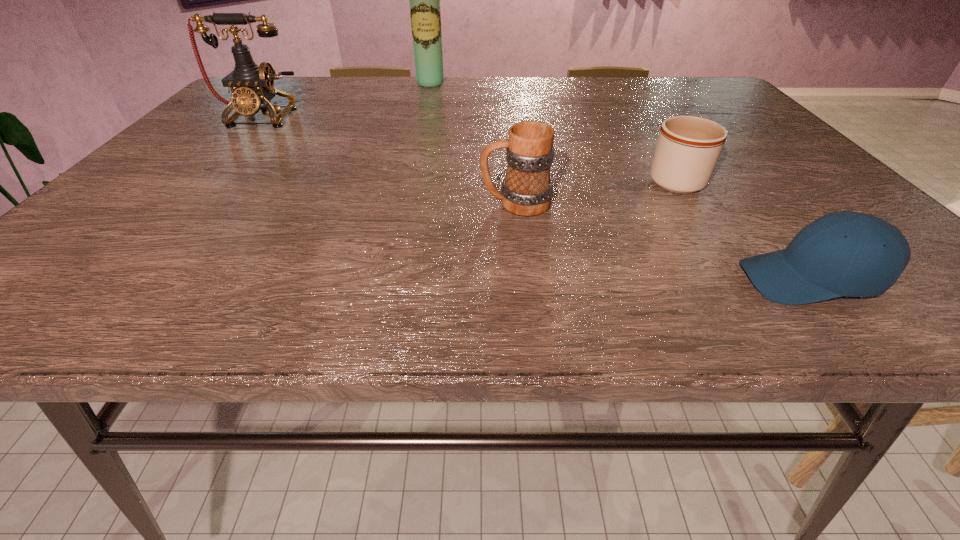
Image resolution: width=960 pixels, height=540 pixels. I want to click on object present at the near edge, so click(846, 253).

This screenshot has width=960, height=540. In order to click on object that is at the left edge in this screenshot , I will do `click(252, 85)`.

The height and width of the screenshot is (540, 960). I want to click on object present at the right edge, so click(x=846, y=253).

At what (x,y) coordinates should I click in order to perform the action: click on object that is at the near right corner. Please return your answer as a coordinate pair (x, y). The height and width of the screenshot is (540, 960). Looking at the image, I should click on (846, 253).

The image size is (960, 540). I want to click on blank space at the far edge of the desktop, so click(x=400, y=85).

In the image, there is a desktop. Where is `vacant space at the near edge`? vacant space at the near edge is located at coordinates (415, 311).

In the image, there is a desktop. Where is `free space at the left edge`? free space at the left edge is located at coordinates (177, 221).

Identify the location of vacant space at the right edge. (802, 191).

I want to click on free spot between the farthest object and the leftmost object, so click(346, 100).

Where is `free space between the third tallest object and the telephone`? This screenshot has width=960, height=540. free space between the third tallest object and the telephone is located at coordinates (388, 160).